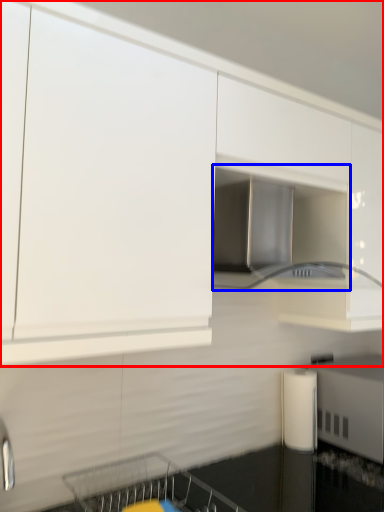
Question: Which of the following is the farthest to the observer, cabinetry (highlighted by a red box) or home appliance (highlighted by a blue box)?

Choices:
 (A) cabinetry
 (B) home appliance

Answer: (B)